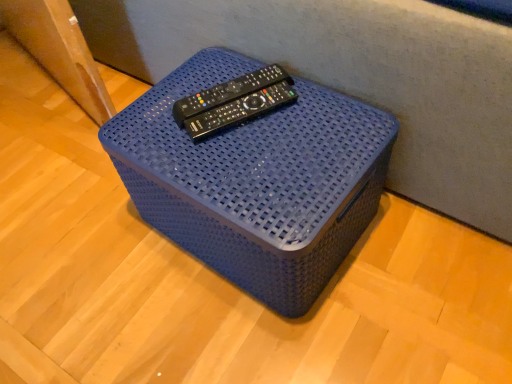
At what (x,y) coordinates should I click in order to perform the action: click on free space in front of black plastic remote at center. Please return your answer as a coordinate pair (x, y). Looking at the image, I should click on (251, 162).